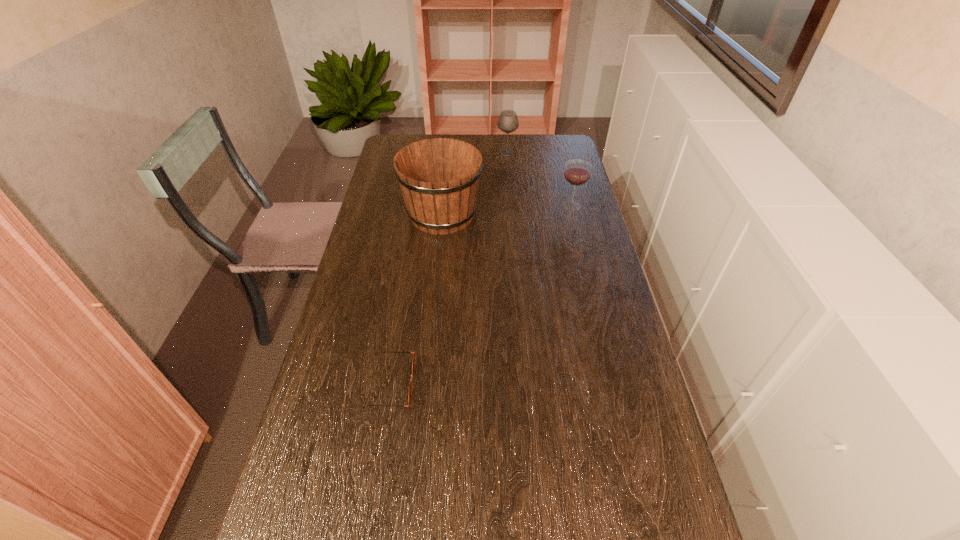
Where is `the tallest object`? This screenshot has width=960, height=540. the tallest object is located at coordinates (439, 177).

The image size is (960, 540). Find the location of `the farther wineglass`. the farther wineglass is located at coordinates (508, 122).

Where is `the second object from right to left`? The width and height of the screenshot is (960, 540). the second object from right to left is located at coordinates (508, 122).

Image resolution: width=960 pixels, height=540 pixels. In order to click on the rightmost object in this screenshot , I will do `click(577, 172)`.

This screenshot has height=540, width=960. Identify the location of the right wineglass. coord(577,172).

I want to click on the nearest object, so pyautogui.click(x=414, y=356).

The image size is (960, 540). In order to click on the shortest object in this screenshot , I will do `click(414, 356)`.

At what (x,y) coordinates should I click in order to perform the action: click on vacant space located 0.110m on the front of the tallest object. Please return your answer as a coordinate pair (x, y). Image resolution: width=960 pixels, height=540 pixels. Looking at the image, I should click on (437, 263).

Locate an element on the screen. The height and width of the screenshot is (540, 960). vacant space located on the front of the second object from right to left is located at coordinates (512, 204).

I want to click on vacant space located on the left of the rightmost object, so click(480, 205).